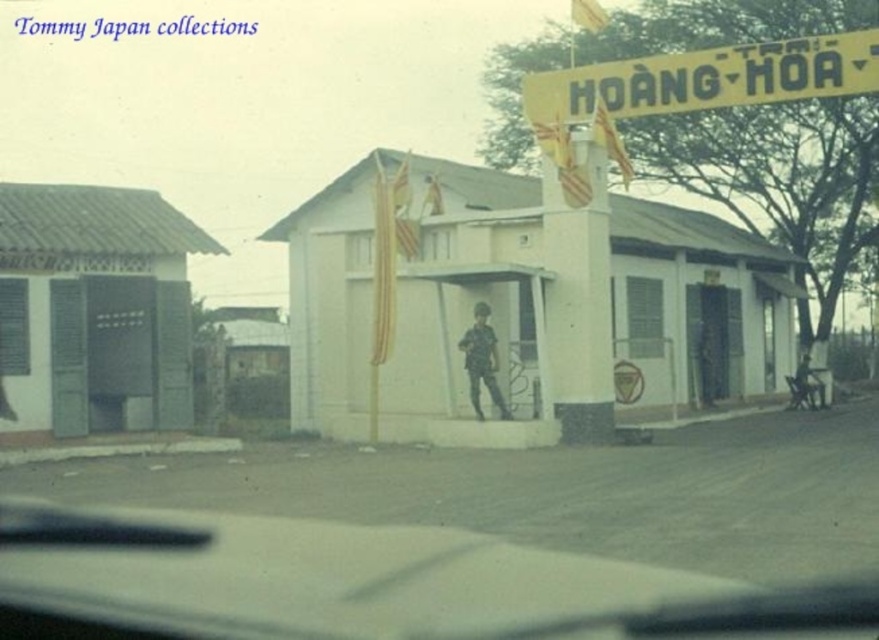
You are driving a car and want to see the yellow paper banner at upper center clearly. Since the transparent glass windshield at center is in the way, will you need to adjust your head position upwards or downwards to look over it?

The transparent glass windshield at center is not as tall as the yellow paper banner at upper center. To see the yellow paper banner at upper center clearly, you would need to tilt your head upwards slightly to look over the windshield.

You are driving a car and see a building with a yellow signboard. You notice the transparent glass windshield at center and camouflage fabric uniform at center. Which object is closer to the bottom of the car windshield?

The transparent glass windshield at center is below camouflage fabric uniform at center, so the transparent glass windshield at center is closer to the bottom of the car windshield.

You are a passenger in the car and want to read the text on the yellow paper banner at upper center. Can you see it clearly through the transparent glass windshield at center?

The transparent glass windshield at center is to the left of the yellow paper banner at upper center, so the banner is positioned to the right of the windshield. Since the windshield is transparent, you should be able to see the yellow paper banner at upper center clearly through it.